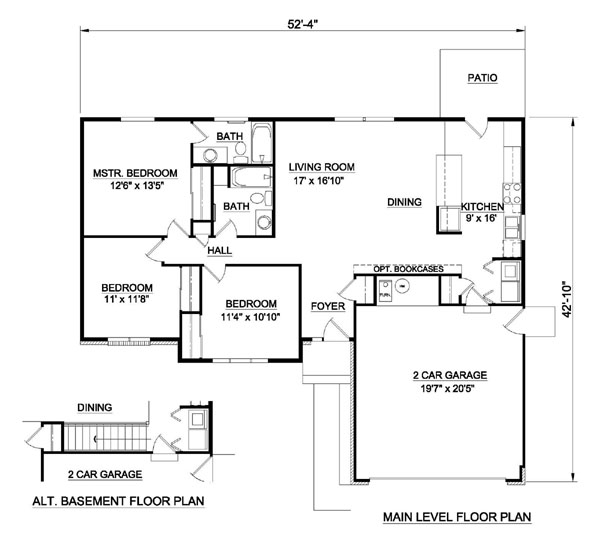
Identify the location of foyer. click(312, 286).